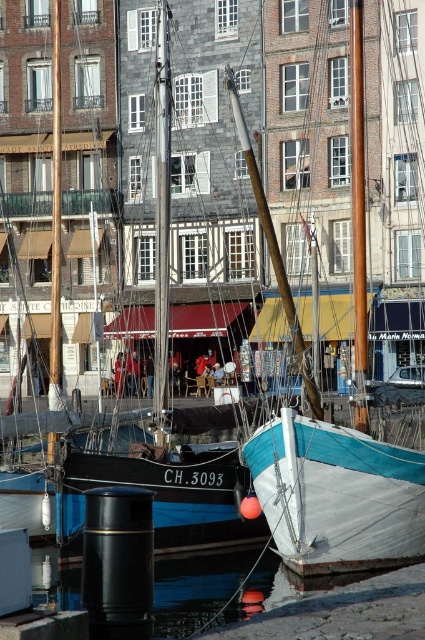
Is point (277, 257) positioned after point (356, 70)?

No, it is not.

From the picture: Is teal canvas sailboat at center shorter than brown polished wood mast at center?

Correct, teal canvas sailboat at center is not as tall as brown polished wood mast at center.

In order to click on teal canvas sailboat at center in this screenshot , I will do `click(334, 424)`.